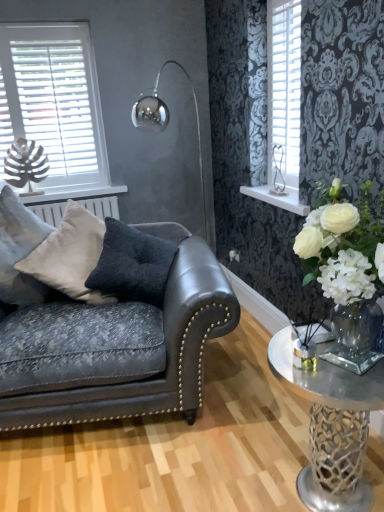
Find the location of a particular element. This screenshot has height=512, width=384. vacant area that lies between clear glass vase at right and leather couch at left is located at coordinates (175, 454).